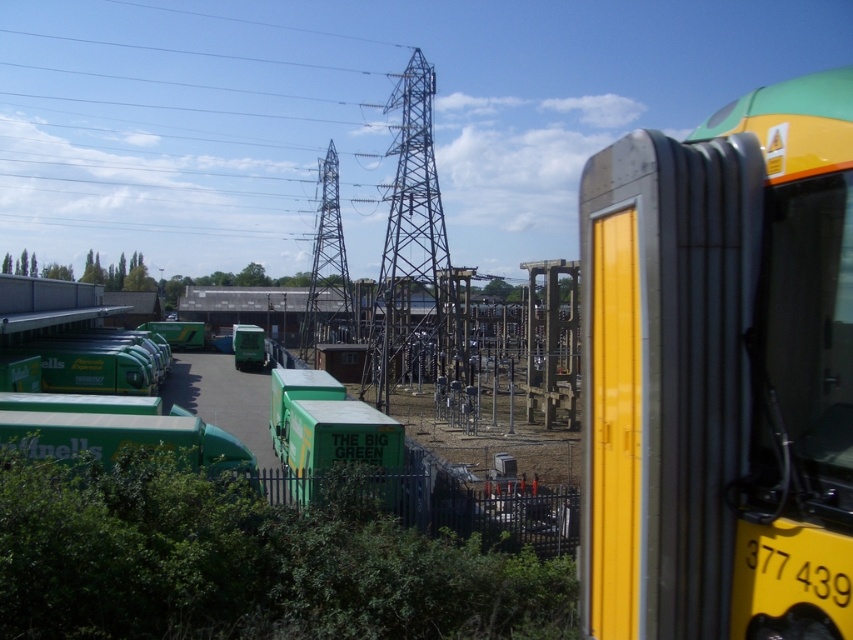
You are a crane operator trying to lift a large box that needs to be placed between the metallic silver tower at center and the green matte truck at center. Considering their heights, which object will you have to be cautious not to hit with the box?

The metallic silver tower at center is taller than the green matte truck at center, so you must be cautious not to hit the metallic silver tower at center with the box.

You are a photographer trying to capture both the yellow metallic bus at right and the metallic silver tower at center in a single frame. Based on their sizes, which object will appear smaller in the photo?

The yellow metallic bus at right will appear smaller in the photo because it is shorter than the metallic silver tower at center.

You are a drone operator who needs to fly a drone from the yellow metallic bus at right to the metallic silver tower at center. The drone has a maximum flight range of 200 feet. Can the drone reach the tower without needing to recharge?

The yellow metallic bus at right and metallic silver tower at center are 195.52 feet apart from each other. Since the drone can fly up to 200 feet, it can reach the tower without needing to recharge.